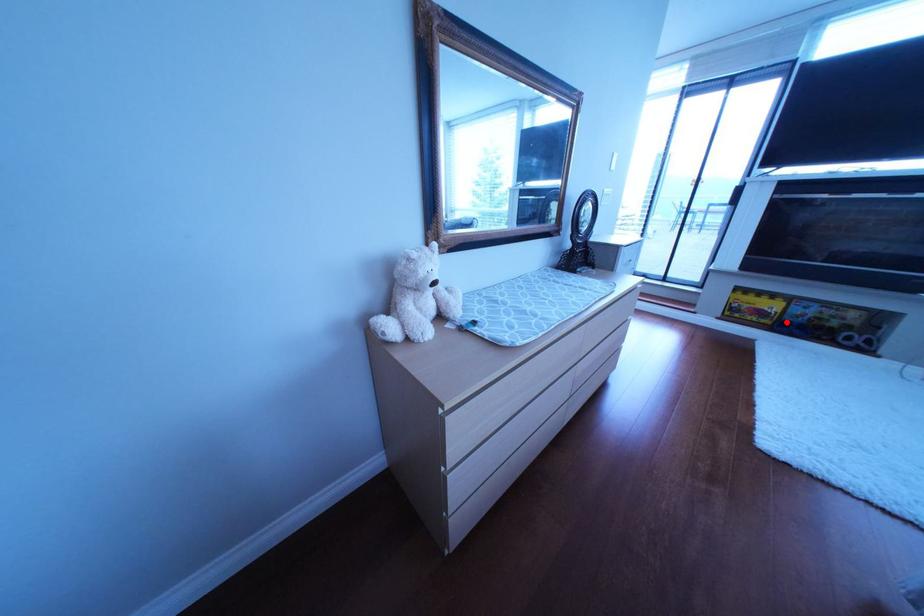
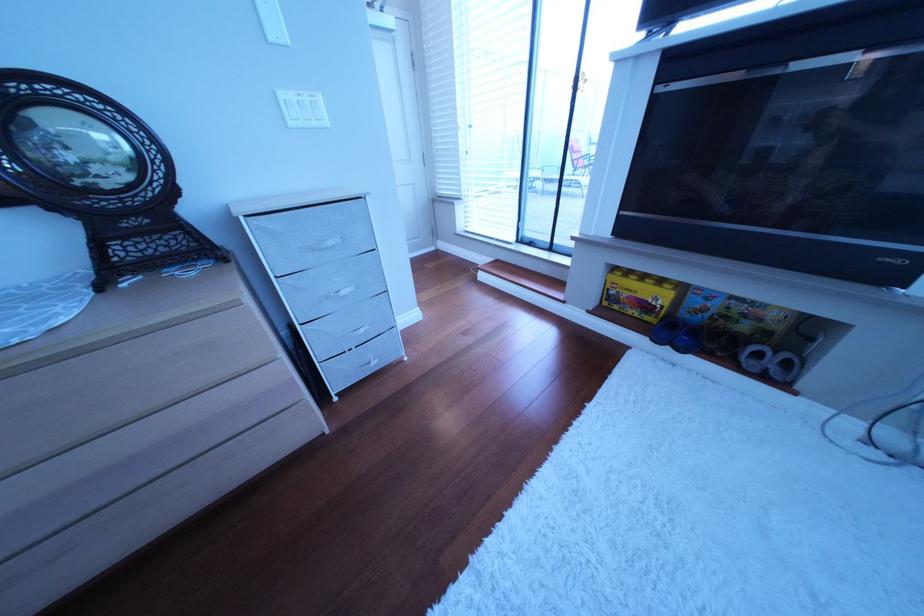
Locate, in the second image, the point that corresponds to the highlighted location in the first image.

(672, 320)